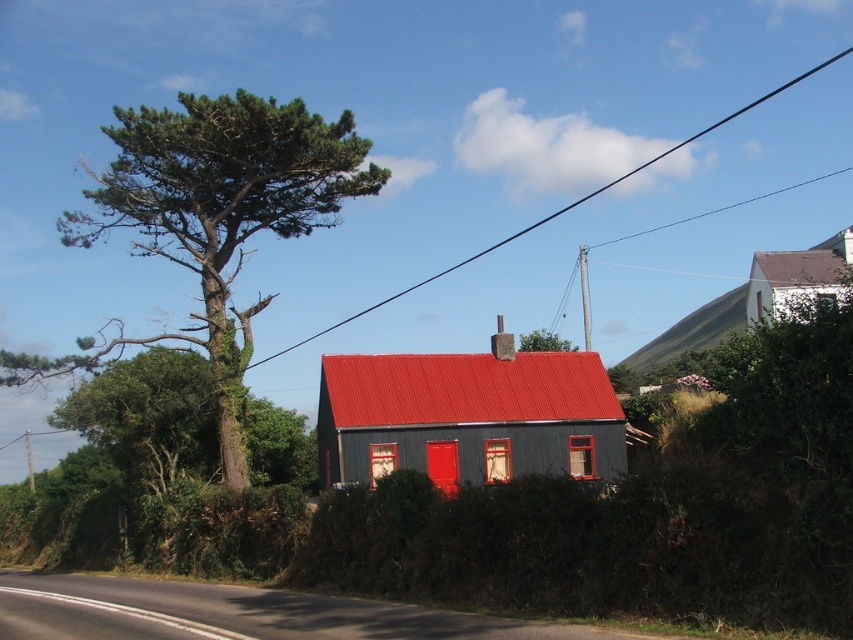
Question: Does green textured tree at upper left have a larger size compared to red corrugated metal house at center?

Choices:
 (A) no
 (B) yes

Answer: (B)

Question: Is red corrugated metal house at center above gray slate roof at upper right?

Choices:
 (A) no
 (B) yes

Answer: (A)

Question: Which of the following is the farthest from the observer?

Choices:
 (A) (558, 348)
 (B) (387, 436)
 (C) (843, 244)
 (D) (328, 168)

Answer: (A)

Question: Which point is farther from the camera taking this photo?

Choices:
 (A) (527, 349)
 (B) (323, 449)
 (C) (772, 269)

Answer: (A)

Question: Can you confirm if gray slate roof at upper right is bigger than green leafy tree at upper center?

Choices:
 (A) yes
 (B) no

Answer: (A)

Question: Which object is positioned closest to the red corrugated metal house at center?

Choices:
 (A) gray slate roof at upper right
 (B) green leafy tree at upper center

Answer: (A)